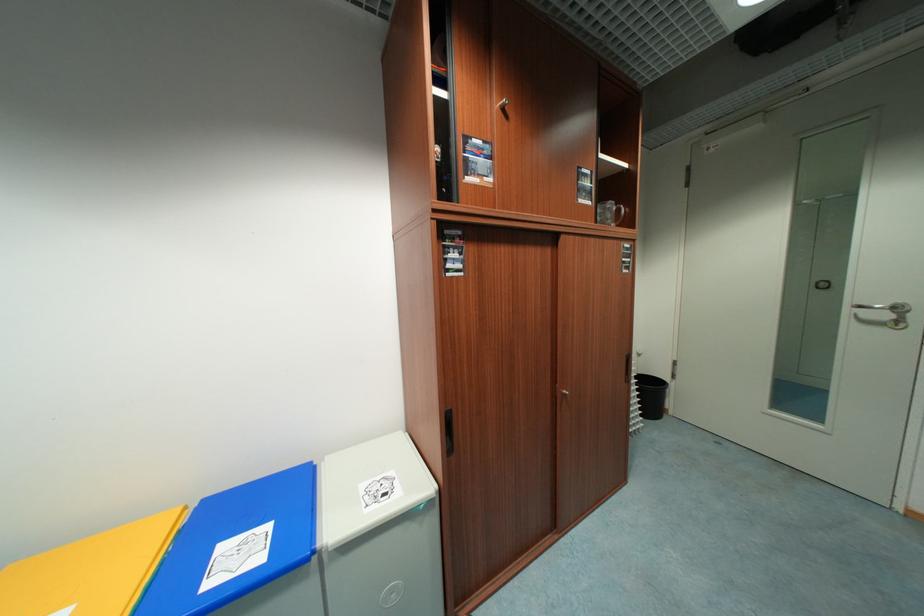
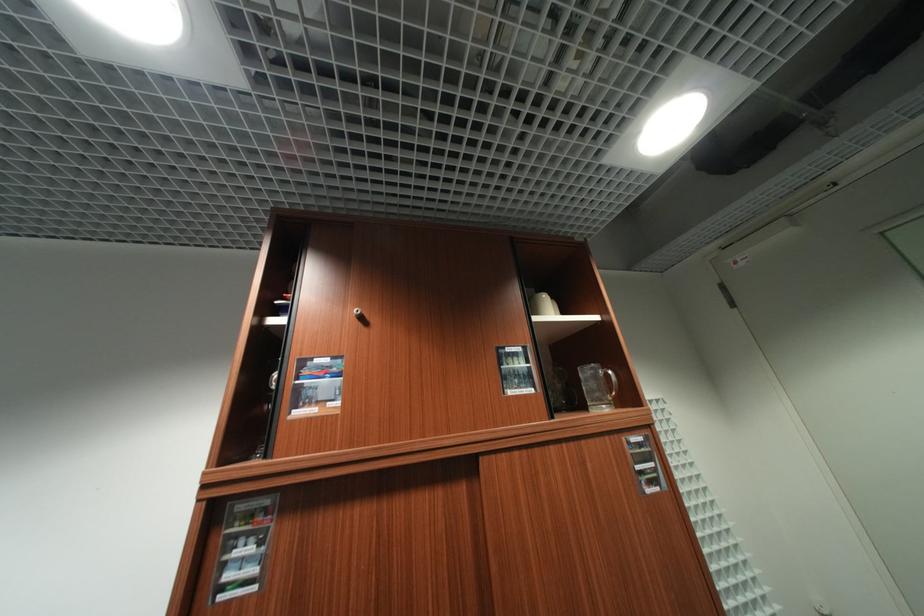
Question: The first image is from the beginning of the video and the second image is from the end. How did the camera likely rotate when shooting the video?

Choices:
 (A) Left
 (B) Right
 (C) Up
 (D) Down

Answer: (C)